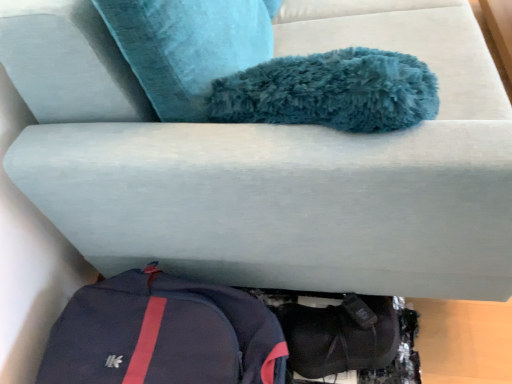
Image resolution: width=512 pixels, height=384 pixels. In order to click on blank space situated above black fabric shoe at lower center (from a real-world perspective) in this screenshot , I will do `click(343, 337)`.